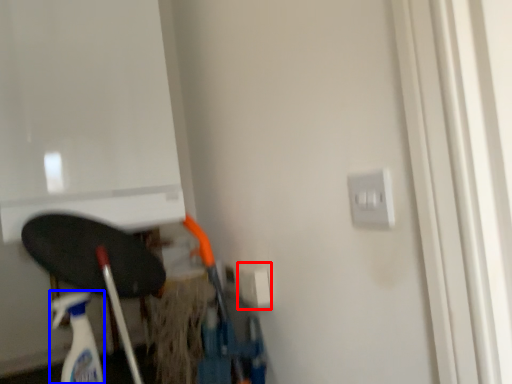
Question: Which point is closer to the camera, electric outlet (highlighted by a red box) or cleaning product (highlighted by a blue box)?

Choices:
 (A) electric outlet
 (B) cleaning product

Answer: (B)